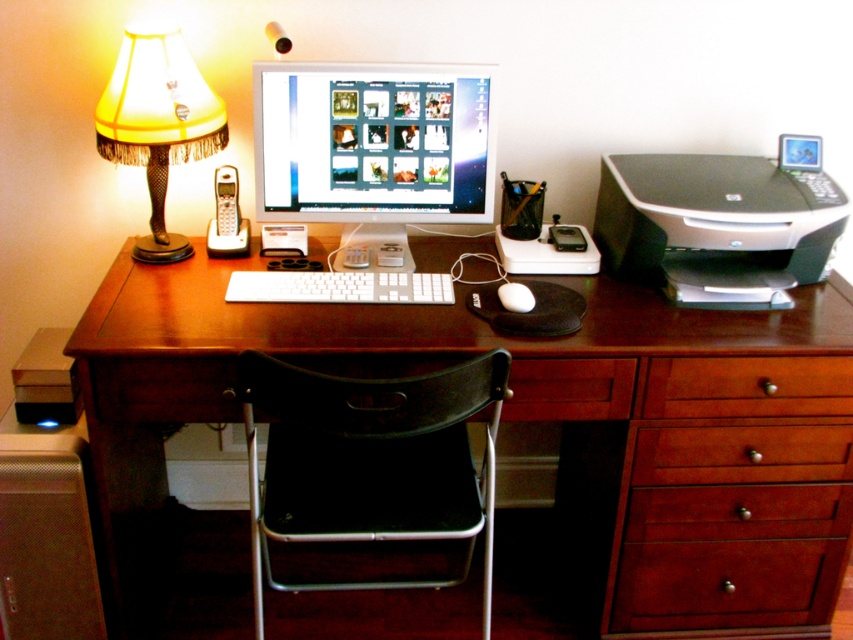
Question: Which object appears closest to the camera in this image?

Choices:
 (A) wooden drawer at right
 (B) white matte mouse at center
 (C) yellow fabric lampshade at upper left
 (D) brown wood drawer at lower right

Answer: (A)

Question: Does white glossy computer monitor at center have a lesser width compared to wooden drawer at right?

Choices:
 (A) no
 (B) yes

Answer: (A)

Question: Which point is closer to the camera?

Choices:
 (A) (387, 586)
 (B) (287, 200)
 (C) (697, 172)

Answer: (B)

Question: Considering the real-world distances, which object is farthest from the white matte keyboard at center?

Choices:
 (A) wooden drawer at right
 (B) white glossy computer monitor at center
 (C) wooden computer desk at center
 (D) black fabric chair at center

Answer: (A)

Question: From the image, what is the correct spatial relationship of wooden computer desk at center in relation to white matte mouse at center?

Choices:
 (A) right
 (B) left

Answer: (B)

Question: Where is wooden computer desk at center located in relation to brown wood drawer at lower right in the image?

Choices:
 (A) below
 (B) above

Answer: (A)